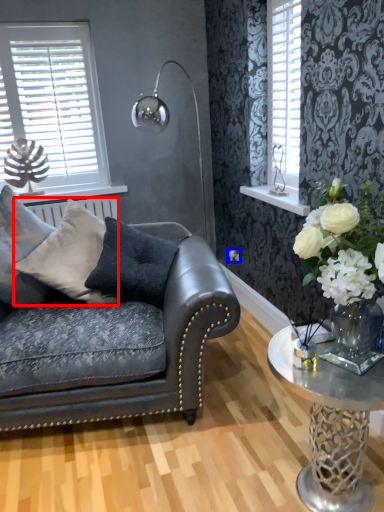
Question: Which of the following is the closest to the observer, pillow (highlighted by a red box) or flower (highlighted by a blue box)?

Choices:
 (A) pillow
 (B) flower

Answer: (A)